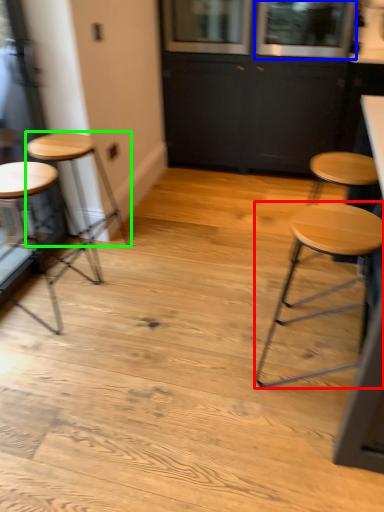
Question: Which is farther away from stool (highlighted by a red box)? window (highlighted by a blue box) or stool (highlighted by a green box)?

Choices:
 (A) window
 (B) stool

Answer: (A)